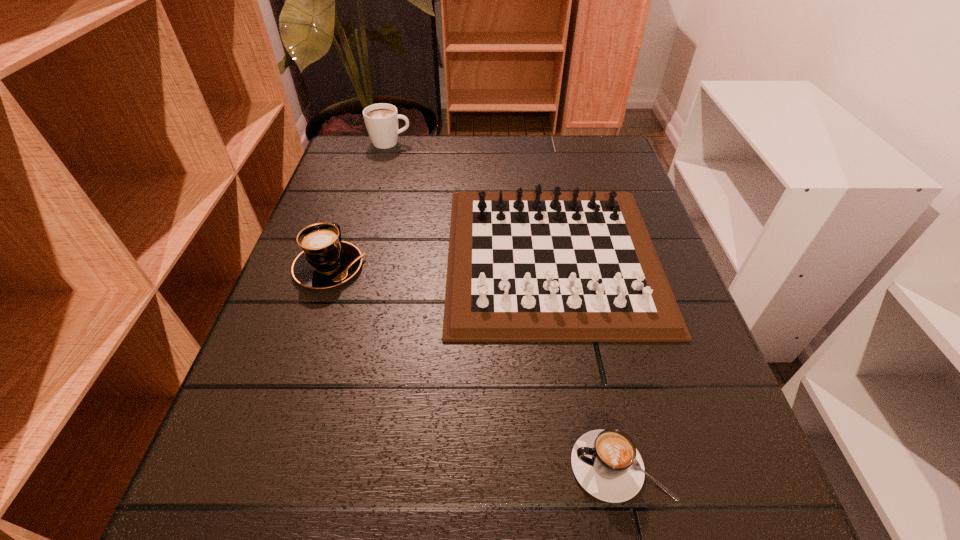
You are a GUI agent. You are given a task and a screenshot of the screen. Output one action in this format:
    pyautogui.click(x=<x>, y=<y>)
    Task: Click on the vacant space located with the handle on the side of the rightmost cappuccino
    
    Given the screenshot: What is the action you would take?
    pyautogui.click(x=488, y=466)

Find the location of a particular element. object present at the far edge is located at coordinates (381, 120).

Where is `object located at the near edge`? The image size is (960, 540). object located at the near edge is located at coordinates (606, 463).

Image resolution: width=960 pixels, height=540 pixels. Identify the location of gameboard at the right edge. (538, 266).

I want to click on cappuccino that is at the right edge, so point(606,463).

The width and height of the screenshot is (960, 540). In order to click on object that is at the far left corner in this screenshot , I will do `click(381, 120)`.

The image size is (960, 540). What are the coordinates of `object positioned at the near right corner` in the screenshot? It's located at coord(606,463).

Identify the location of free spot at the far edge of the desktop. (480, 174).

Identify the location of vacant space at the near edge. (484, 485).

The height and width of the screenshot is (540, 960). In order to click on vacant area at the left edge of the desktop in this screenshot , I will do `click(302, 471)`.